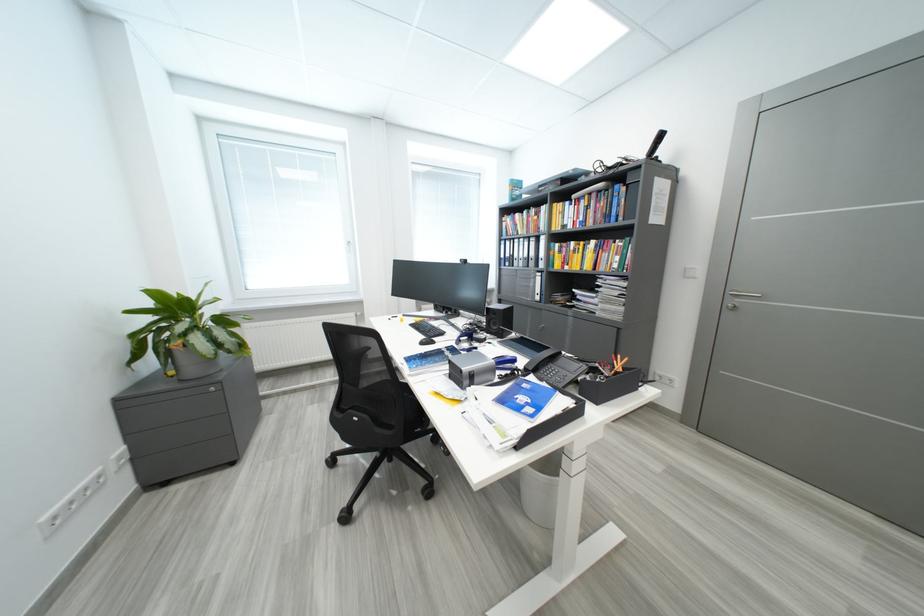
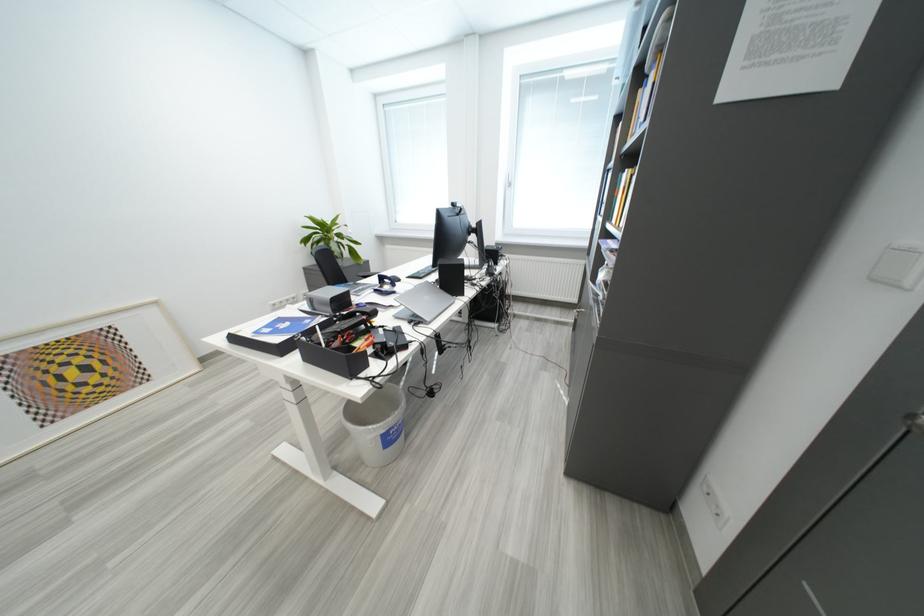
Where in the second image is the point corresponding to (533,387) from the first image?

(317, 323)